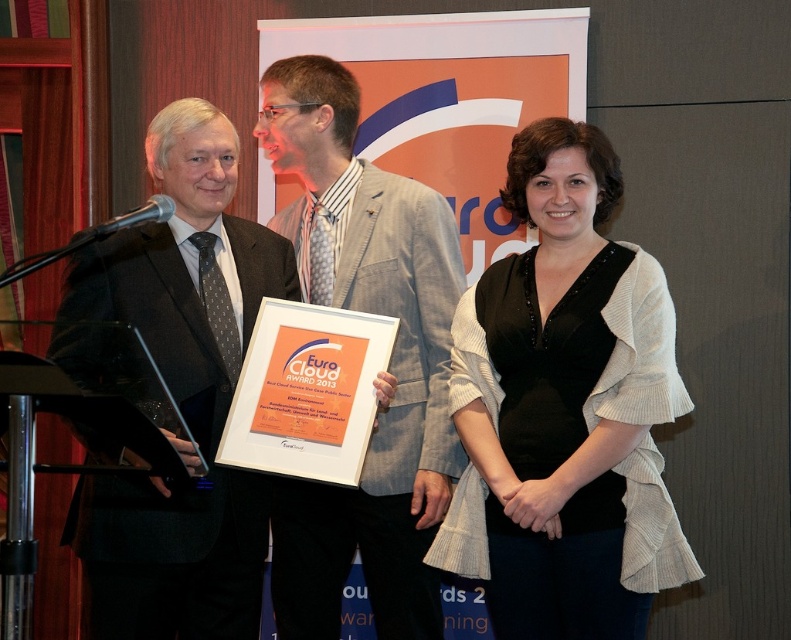
Question: Is black textured sweater at center bigger than light gray textured blazer at center?

Choices:
 (A) no
 (B) yes

Answer: (A)

Question: Which object is the closest to the matte black suit at center?

Choices:
 (A) black textured sweater at center
 (B) light gray textured blazer at center

Answer: (B)

Question: Is black textured sweater at center to the left of light gray textured blazer at center from the viewer's perspective?

Choices:
 (A) no
 (B) yes

Answer: (A)

Question: Which is farther from the black textured sweater at center?

Choices:
 (A) light gray textured blazer at center
 (B) matte black suit at center

Answer: (B)

Question: Does black textured sweater at center have a larger size compared to light gray textured blazer at center?

Choices:
 (A) yes
 (B) no

Answer: (B)

Question: Which of the following is the farthest from the observer?

Choices:
 (A) light gray textured blazer at center
 (B) matte black suit at center

Answer: (A)